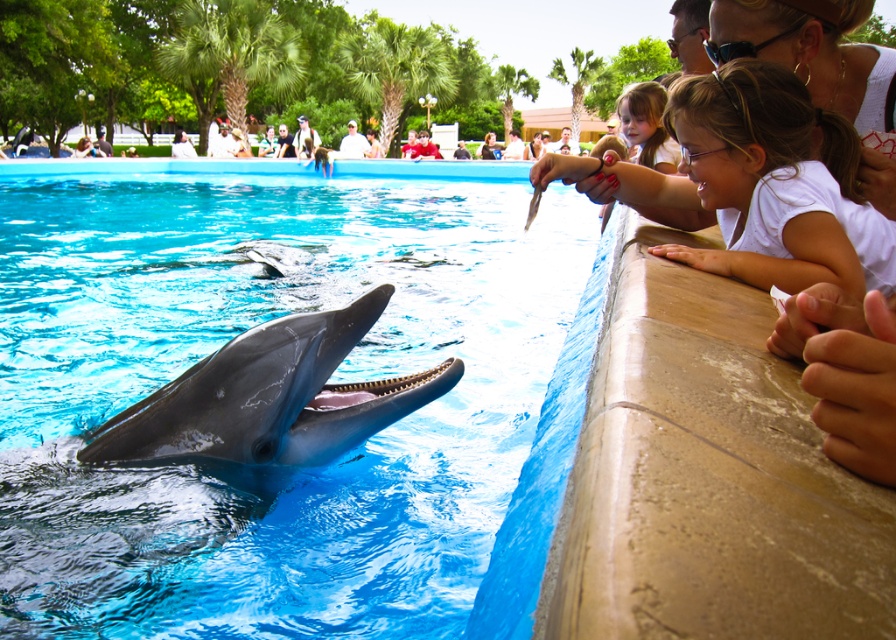
Question: Does blue smooth water at center appear on the left side of white matte shirt at upper right?

Choices:
 (A) yes
 (B) no

Answer: (A)

Question: Is smooth gray dolphin at center further to camera compared to white matte hair at upper right?

Choices:
 (A) yes
 (B) no

Answer: (B)

Question: Observing the image, what is the correct spatial positioning of blue smooth water at center in reference to smooth gray dolphin at center?

Choices:
 (A) left
 (B) right

Answer: (A)

Question: Which object appears closest to the camera in this image?

Choices:
 (A) smooth gray dolphin at center
 (B) blue smooth water at center

Answer: (B)

Question: Which object is the farthest from the white matte shirt at upper right?

Choices:
 (A) smooth gray dolphin at center
 (B) white matte hair at upper right

Answer: (A)

Question: Which object appears farthest from the camera in this image?

Choices:
 (A) smooth gray dolphin at center
 (B) white matte hair at upper right
 (C) blue smooth water at center
 (D) white matte shirt at upper right

Answer: (B)